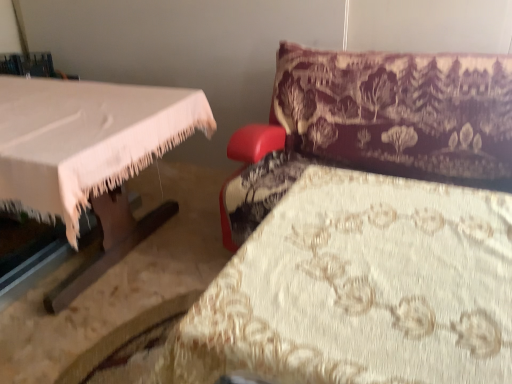
Question: Is floral cream fabric at lower right taller or shorter than velvet-like burgundy couch at upper right?

Choices:
 (A) short
 (B) tall

Answer: (B)

Question: Is floral cream fabric at lower right wider or thinner than velvet-like burgundy couch at upper right?

Choices:
 (A) wide
 (B) thin

Answer: (B)

Question: From a real-world perspective, relative to velvet-like burgundy couch at upper right, is floral cream fabric at lower right vertically above or below?

Choices:
 (A) below
 (B) above

Answer: (A)

Question: Is point (373, 168) positioned closer to the camera than point (357, 327)?

Choices:
 (A) closer
 (B) farther

Answer: (B)

Question: Is velvet-like burgundy couch at upper right to the left or to the right of floral cream fabric at lower right in the image?

Choices:
 (A) right
 (B) left

Answer: (A)

Question: Choose the correct answer: Is velvet-like burgundy couch at upper right inside floral cream fabric at lower right or outside it?

Choices:
 (A) inside
 (B) outside

Answer: (B)

Question: From the image's perspective, is velvet-like burgundy couch at upper right above or below floral cream fabric at lower right?

Choices:
 (A) below
 (B) above

Answer: (B)